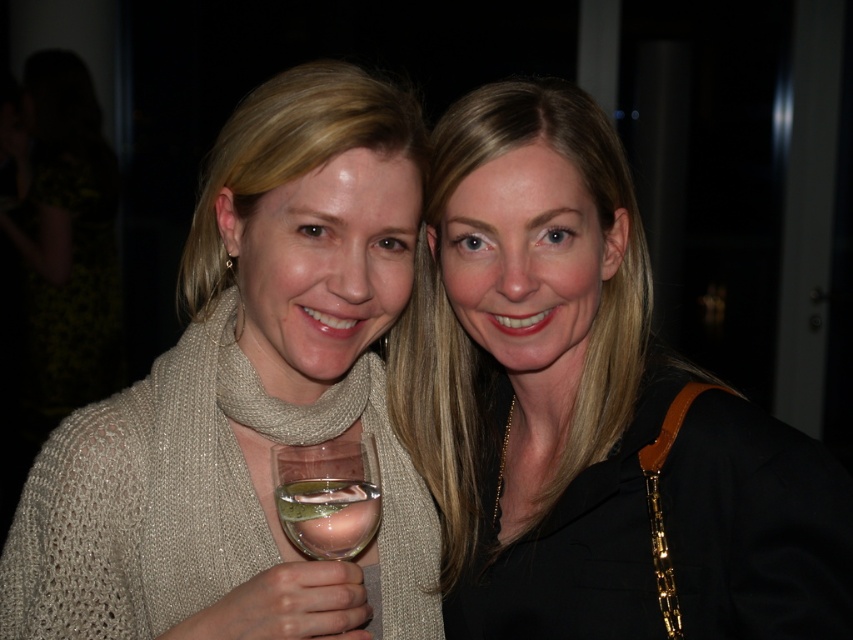
The height and width of the screenshot is (640, 853). I want to click on clear glass wine glass at center, so click(328, 496).

Does clear glass wine glass at center have a greater height compared to clear glass wine at lower center?

Yes.

Between point (339, 550) and point (282, 483), which one is positioned behind?

The point (282, 483) is more distant.

Find the location of a particular element. The width and height of the screenshot is (853, 640). clear glass wine glass at center is located at coordinates (328, 496).

Looking at this image, who is shorter, knitted beige scarf at center or clear glass wine at lower center?

With less height is clear glass wine at lower center.

Based on the photo, does knitted beige scarf at center have a smaller size compared to clear glass wine at lower center?

Actually, knitted beige scarf at center might be larger than clear glass wine at lower center.

You are a GUI agent. You are given a task and a screenshot of the screen. Output one action in this format:
    pyautogui.click(x=<x>, y=<y>)
    Task: Click on the knitted beige scarf at center
    The image size is (853, 640).
    Given the screenshot: What is the action you would take?
    pyautogui.click(x=251, y=397)

How much distance is there between matte black jacket at center and clear glass wine at lower center?

matte black jacket at center and clear glass wine at lower center are 12.45 inches apart.

Between matte black jacket at center and clear glass wine at lower center, which one is positioned higher?

matte black jacket at center

Is point (553, 477) positioned behind point (351, 545)?

That is True.

This screenshot has width=853, height=640. I want to click on matte black jacket at center, so coord(592,410).